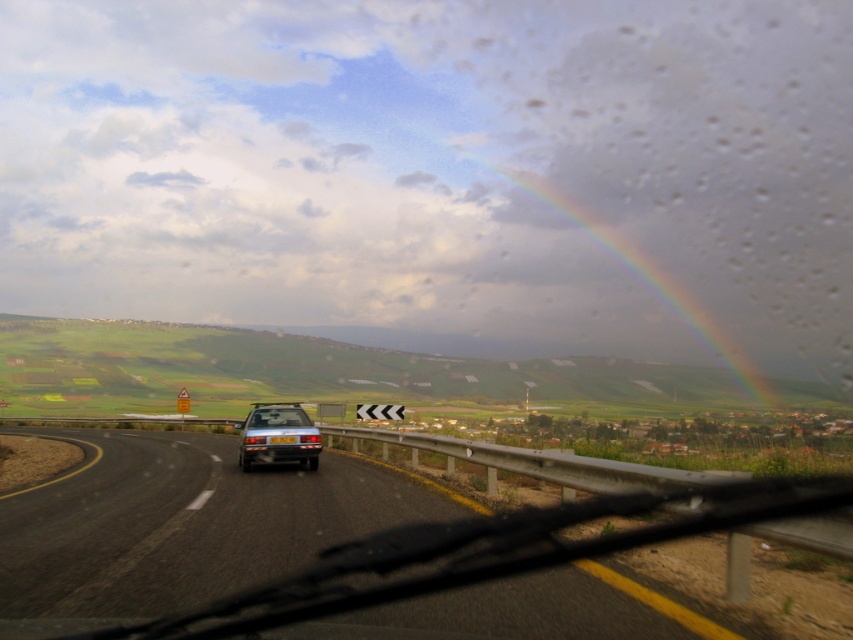
Between point (608, 353) and point (289, 436), which one is positioned in front?

Positioned in front is point (289, 436).

Which is more to the right, rainbow at upper center or yellow plastic license plate at center?

Positioned to the right is rainbow at upper center.

The image size is (853, 640). I want to click on rainbow at upper center, so click(630, 296).

This screenshot has height=640, width=853. Identify the location of rainbow at upper center. (630, 296).

Is point (238, 452) farther from viewer compared to point (300, 417)?

Yes, it is.

Identify the location of metallic silver hatchback at center. (277, 435).

Who is shorter, metallic silver hatchback at center or yellow plastic license plate at center?

With less height is yellow plastic license plate at center.

Between metallic silver hatchback at center and yellow plastic license plate at center, which one is positioned lower?

Positioned lower is metallic silver hatchback at center.

You are a GUI agent. You are given a task and a screenshot of the screen. Output one action in this format:
    pyautogui.click(x=<x>, y=<y>)
    Task: Click on the metallic silver hatchback at center
    
    Given the screenshot: What is the action you would take?
    pyautogui.click(x=277, y=435)